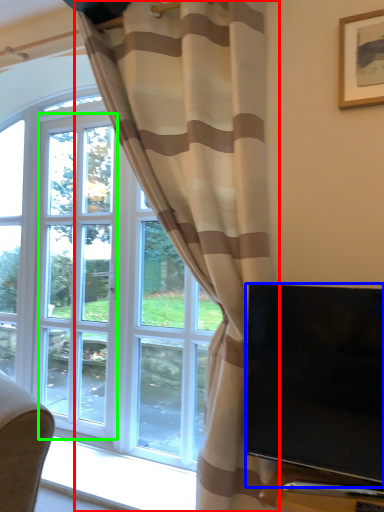
Question: Based on their relative distances, which object is nearer to curtain (highlighted by a red box)? Choose from television (highlighted by a blue box) and screen door (highlighted by a green box).

Choices:
 (A) television
 (B) screen door

Answer: (A)